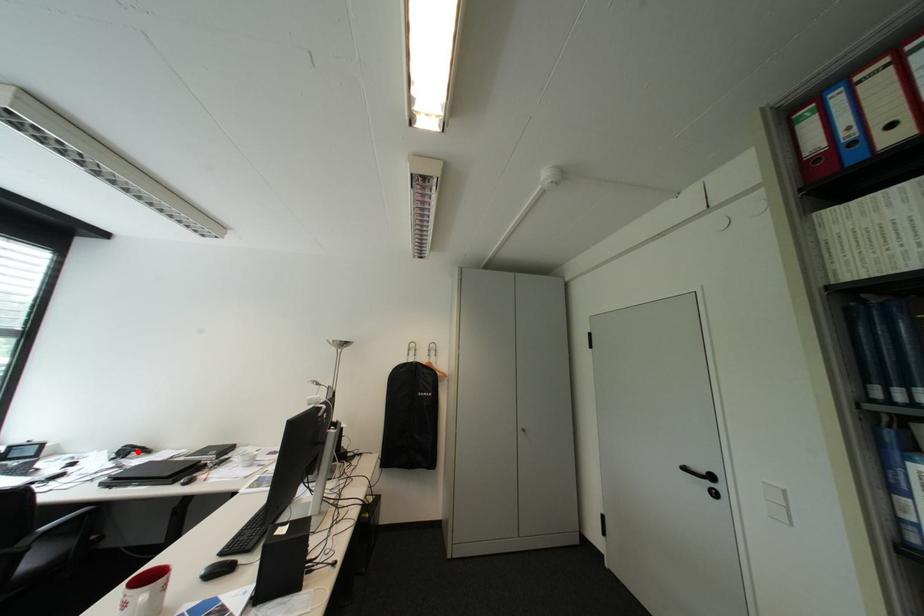
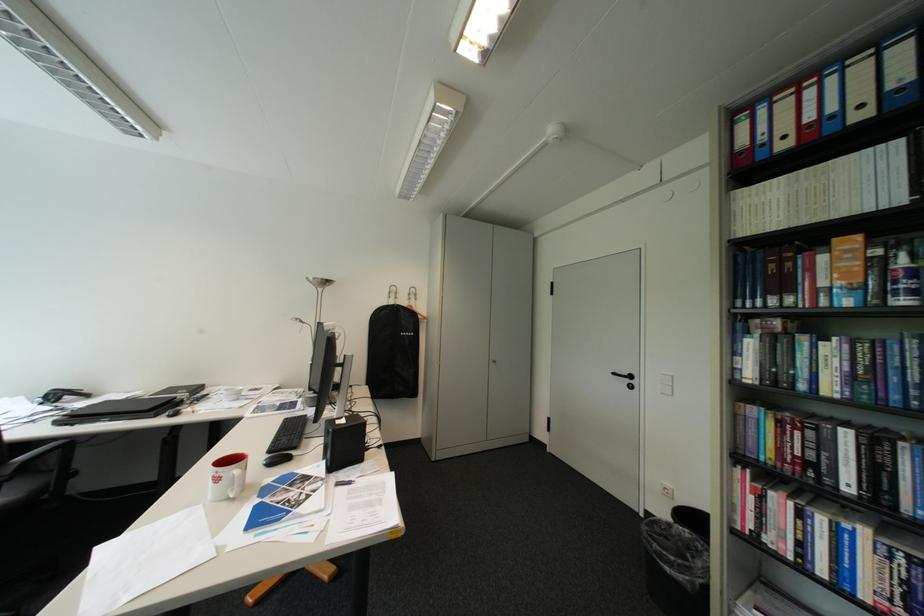
Where in the second image is the point corresponding to the highlighted location from the first image?

(67, 397)